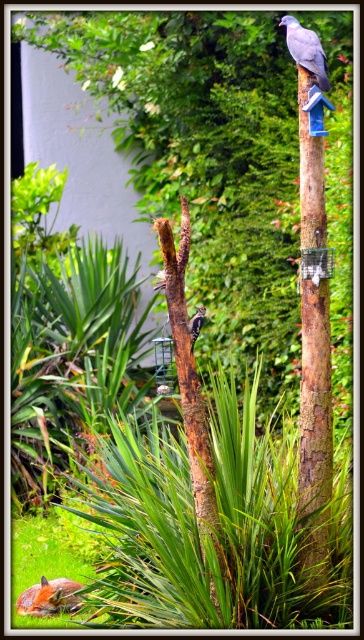
You are a birdwatcher observing the matte gray pigeon at upper center and the brown speckled woodpecker at center. Which bird is positioned more to the left in the image?

The matte gray pigeon at upper center is positioned to the left of the brown speckled woodpecker at center, so it is more to the left.

You are a birdwatcher observing the matte gray pigeon at upper center and the brown speckled woodpecker at center. Which bird is closer to you?

The matte gray pigeon at upper center is closer to you because it is further to the viewer than the brown speckled woodpecker at center.

You are a birdwatcher observing the matte gray pigeon at upper center and the gray matte bird at upper right. Which one is located more to the left side?

The matte gray pigeon at upper center is positioned on the left side of the gray matte bird at upper right, so it is more to the left.